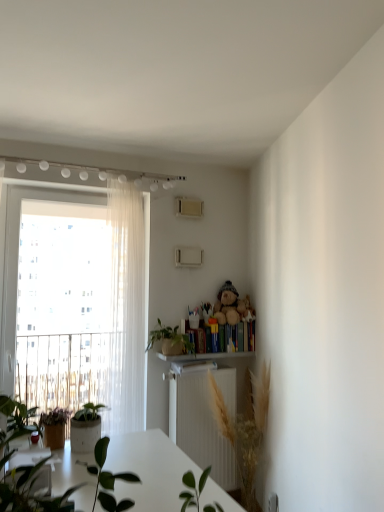
Question: Would you say hardcover books at right is part of fuzzy brown teddy bear at upper center's contents?

Choices:
 (A) yes
 (B) no

Answer: (B)

Question: Is fuzzy brown teddy bear at upper center at the left side of hardcover books at right?

Choices:
 (A) no
 (B) yes

Answer: (A)

Question: Is fuzzy brown teddy bear at upper center looking in the opposite direction of hardcover books at right?

Choices:
 (A) no
 (B) yes

Answer: (A)

Question: Is fuzzy brown teddy bear at upper center smaller than hardcover books at right?

Choices:
 (A) yes
 (B) no

Answer: (B)

Question: Is fuzzy brown teddy bear at upper center positioned behind hardcover books at right?

Choices:
 (A) yes
 (B) no

Answer: (B)

Question: From the image's perspective, is fuzzy brown teddy bear at upper center on hardcover books at right?

Choices:
 (A) yes
 (B) no

Answer: (A)

Question: Considering the relative sizes of green matte plant at center, the 2th houseplant from the bottom, and fuzzy brown teddy bear at upper center in the image provided, is green matte plant at center, the 2th houseplant from the bottom, thinner than fuzzy brown teddy bear at upper center?

Choices:
 (A) yes
 (B) no

Answer: (B)

Question: Can you confirm if green matte plant at center, which is the 1th houseplant in top-to-bottom order, is taller than fuzzy brown teddy bear at upper center?

Choices:
 (A) yes
 (B) no

Answer: (B)

Question: Is green matte plant at center, the 2th houseplant from the bottom, beside fuzzy brown teddy bear at upper center?

Choices:
 (A) yes
 (B) no

Answer: (B)

Question: Is there a large distance between green matte plant at center, which is the 1th houseplant in top-to-bottom order, and fuzzy brown teddy bear at upper center?

Choices:
 (A) yes
 (B) no

Answer: (B)

Question: Can we say green matte plant at center, which is the 1th houseplant in top-to-bottom order, lies outside fuzzy brown teddy bear at upper center?

Choices:
 (A) no
 (B) yes

Answer: (B)

Question: Is green matte plant at center, which is the 1th houseplant in top-to-bottom order, at the left side of fuzzy brown teddy bear at upper center?

Choices:
 (A) no
 (B) yes

Answer: (B)

Question: From a real-world perspective, is green leafy plant at center, which is counted as the first houseplant, starting from the bottom, positioned over fuzzy brown teddy bear at upper center based on gravity?

Choices:
 (A) no
 (B) yes

Answer: (A)